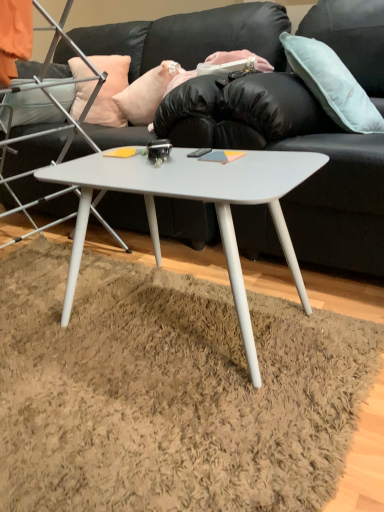
Question: Does peach fabric pillow at upper left, arranged as the third pillow when viewed from the right, turn towards white matte coffee table at center?

Choices:
 (A) yes
 (B) no

Answer: (B)

Question: Is peach fabric pillow at upper left, the 1th pillow in the left-to-right sequence, at the left side of white matte coffee table at center?

Choices:
 (A) no
 (B) yes

Answer: (B)

Question: Is peach fabric pillow at upper left, the 1th pillow in the left-to-right sequence, directly adjacent to white matte coffee table at center?

Choices:
 (A) yes
 (B) no

Answer: (B)

Question: From a real-world perspective, is peach fabric pillow at upper left, the 1th pillow in the left-to-right sequence, below white matte coffee table at center?

Choices:
 (A) no
 (B) yes

Answer: (A)

Question: Is peach fabric pillow at upper left, the 1th pillow in the left-to-right sequence, thinner than white matte coffee table at center?

Choices:
 (A) no
 (B) yes

Answer: (B)

Question: Is peach fabric pillow at upper left, the 1th pillow in the left-to-right sequence, oriented away from white matte coffee table at center?

Choices:
 (A) yes
 (B) no

Answer: (B)

Question: From a real-world perspective, is light blue fabric pillow at upper right, which is counted as the 3th pillow, starting from the left, positioned over white matte coffee table at center based on gravity?

Choices:
 (A) yes
 (B) no

Answer: (A)

Question: Is light blue fabric pillow at upper right, which is counted as the 3th pillow, starting from the left, thinner than white matte coffee table at center?

Choices:
 (A) yes
 (B) no

Answer: (A)

Question: Is light blue fabric pillow at upper right, the first pillow when ordered from right to left, not inside white matte coffee table at center?

Choices:
 (A) no
 (B) yes

Answer: (B)

Question: Can you confirm if light blue fabric pillow at upper right, the first pillow when ordered from right to left, is smaller than white matte coffee table at center?

Choices:
 (A) yes
 (B) no

Answer: (A)

Question: Is light blue fabric pillow at upper right, which is counted as the 3th pillow, starting from the left, bigger than white matte coffee table at center?

Choices:
 (A) no
 (B) yes

Answer: (A)

Question: From a real-world perspective, is light blue fabric pillow at upper right, which is counted as the 3th pillow, starting from the left, located higher than black leather couch at center?

Choices:
 (A) no
 (B) yes

Answer: (B)